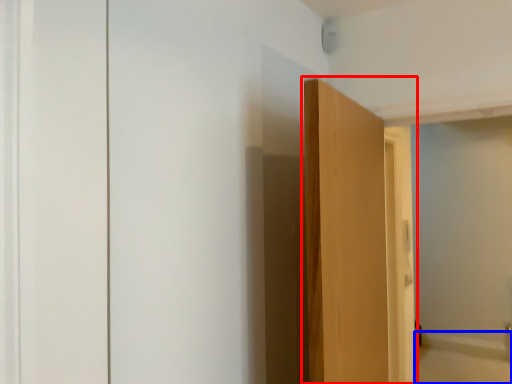
Question: Which object appears closest to the camera in this image, door (highlighted by a red box) or bath (highlighted by a blue box)?

Choices:
 (A) door
 (B) bath

Answer: (A)